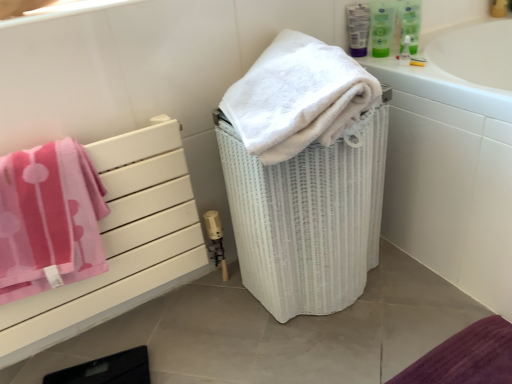
Locate an element on the screen. The height and width of the screenshot is (384, 512). vacant area in front of green plastic mouthwash at upper right, which appears as the 2th mouthwash when viewed from the right is located at coordinates (402, 63).